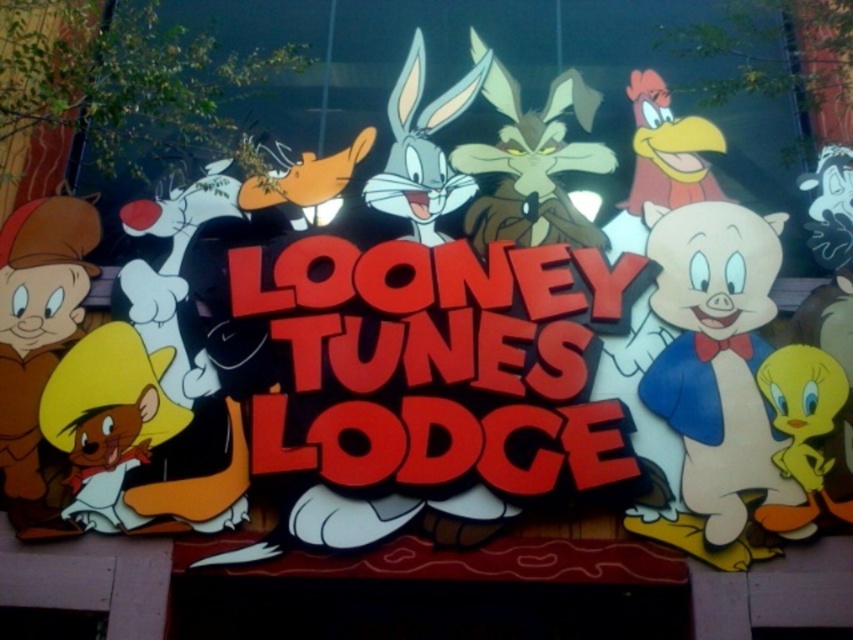
Question: Can you confirm if white paper pig at right is wider than brown matte/tanned skin at left?

Choices:
 (A) no
 (B) yes

Answer: (A)

Question: Does white paper pig at right appear under brown matte/tanned skin at left?

Choices:
 (A) no
 (B) yes

Answer: (A)

Question: Which object is closer to the camera taking this photo?

Choices:
 (A) white paper pig at right
 (B) brown matte/tanned skin at left

Answer: (A)

Question: Does white paper pig at right appear on the left side of brown matte/tanned skin at left?

Choices:
 (A) no
 (B) yes

Answer: (A)